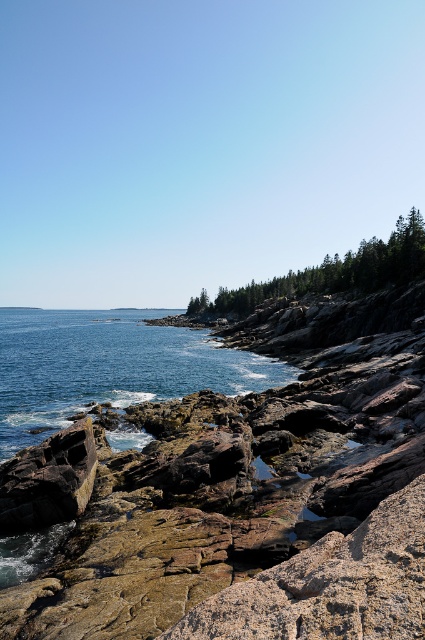
You are a hiker planning to cross the rocky shoreline. You see the green textured trees at center and the rusty rock at lower left. Which object is wider when viewed from above?

The green textured trees at center is wider than the rusty rock at lower left according to the description provided.

You are a hiker trying to navigate the rocky shoreline. You see the green textured trees at center and the rusty rock at lower left. Which object would you need to look up more to see?

The green textured trees at center are larger in size than the rusty rock at lower left, so you would need to look up more to see the green textured trees at center.

You are standing on the rocky shoreline and want to cross to the other side. You see the blue water at center and the green textured trees at center. Which path would allow you to walk farther before encountering an obstacle?

The blue water at center has a larger width than the green textured trees at center, so walking along the blue water at center would allow you to go farther before reaching an obstacle.